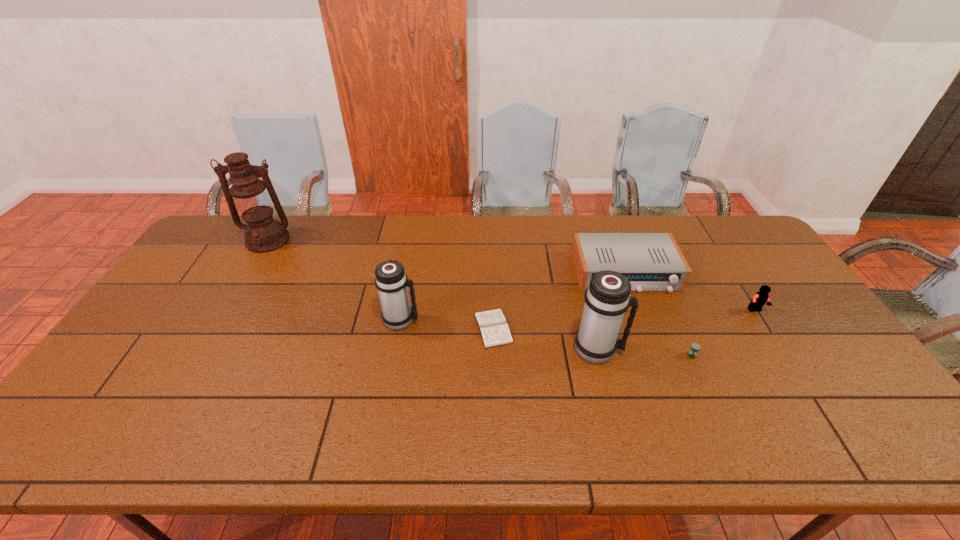
The image size is (960, 540). I want to click on empty location between the radio receiver and the second shortest object, so click(x=659, y=313).

This screenshot has height=540, width=960. In order to click on vacant region between the Lego and the tallest object in this screenshot , I will do `click(512, 275)`.

Where is `empty space that is in between the left thermos bottle and the Lego`? empty space that is in between the left thermos bottle and the Lego is located at coordinates pyautogui.click(x=578, y=315).

Find the location of a particular element. empty space that is in between the fifth object from right to left and the nearer thermos bottle is located at coordinates (545, 339).

You are a GUI agent. You are given a task and a screenshot of the screen. Output one action in this format:
    pyautogui.click(x=<x>, y=<y>)
    Task: Click on the free spot between the fifth tallest object and the diary
    This screenshot has width=960, height=540.
    Given the screenshot: What is the action you would take?
    pyautogui.click(x=560, y=300)

I want to click on free space between the rightmost object and the radio receiver, so click(690, 291).

In order to click on empty location between the beer can and the farther thermos bottle in this screenshot , I will do `click(546, 338)`.

Locate an element on the screen. Image resolution: width=960 pixels, height=540 pixels. object identified as the closest to the beer can is located at coordinates (607, 298).

This screenshot has width=960, height=540. I want to click on object that is the second closest to the tallest object, so click(x=492, y=324).

Identify the location of vacant region that satisfies the following two spatial constraints: 1. on the front-facing side of the rightmost object; 2. on the side with the handle of the nearer thermos bottle. (780, 350).